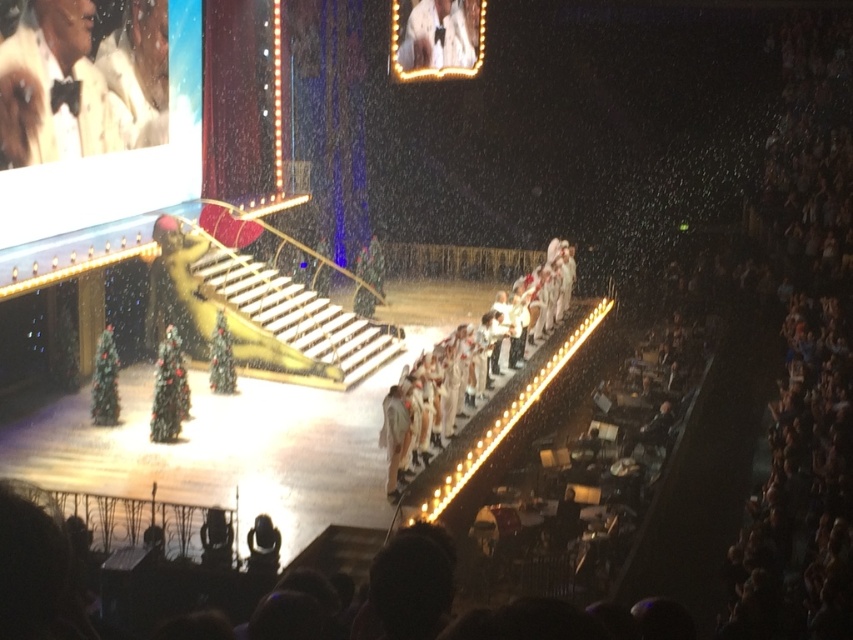
You are a stagehand standing at the back of the stage. You need to move a prop from point [428,244] to point [405,28]. Which direction should you move the prop?

Since point [428,244] is closer to you than point [405,28], you should move the prop away from you towards the background of the stage.

In the scene shown: You are a photographer at the back of the stage. You need to capture a photo that includes both the white fabric dress at center and the white satin dress at upper center. Which one should you adjust your camera focus to first to ensure both are in the frame?

The white fabric dress at center is to the right of the white satin dress at upper center, so you should focus on the white satin dress at upper center first to ensure both are in the frame.

You are a photographer at the back of the stage. You need to capture a clear photo of both the white fabric dress at center and the white satin dress at upper center. Which dress should you focus on first to ensure it doesn t get blocked by the other?

The white fabric dress at center is taller than the white satin dress at upper center, so you should focus on the white fabric dress at center first to prevent it from blocking the shorter one.